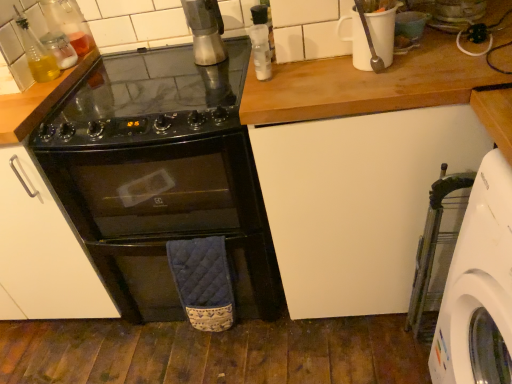
Question: Is white plastic washing machine at lower right shorter than translucent glass bottle at upper left, positioned as the second bottle in left-to-right order?

Choices:
 (A) no
 (B) yes

Answer: (A)

Question: Is white plastic washing machine at lower right turned away from translucent glass bottle at upper left, positioned as the 2th bottle in right-to-left order?

Choices:
 (A) yes
 (B) no

Answer: (B)

Question: From the image's perspective, would you say white plastic washing machine at lower right is positioned over translucent glass bottle at upper left, positioned as the 2th bottle in right-to-left order?

Choices:
 (A) no
 (B) yes

Answer: (A)

Question: Is white plastic washing machine at lower right closer to camera compared to translucent glass bottle at upper left, positioned as the 2th bottle in right-to-left order?

Choices:
 (A) yes
 (B) no

Answer: (A)

Question: Are white plastic washing machine at lower right and translucent glass bottle at upper left, positioned as the second bottle in left-to-right order, making contact?

Choices:
 (A) yes
 (B) no

Answer: (B)

Question: Is white plastic washing machine at lower right wider than translucent glass bottle at upper left, positioned as the second bottle in left-to-right order?

Choices:
 (A) no
 (B) yes

Answer: (B)

Question: Does metallic silver grinder at upper center have a smaller size compared to translucent glass bottle at upper left, positioned as the 2th bottle in right-to-left order?

Choices:
 (A) no
 (B) yes

Answer: (A)

Question: From a real-world perspective, does metallic silver grinder at upper center stand above translucent glass bottle at upper left, positioned as the 2th bottle in right-to-left order?

Choices:
 (A) no
 (B) yes

Answer: (B)

Question: Is translucent glass bottle at upper left, positioned as the second bottle in left-to-right order, a part of metallic silver grinder at upper center?

Choices:
 (A) no
 (B) yes

Answer: (A)

Question: Is metallic silver grinder at upper center bigger than translucent glass bottle at upper left, positioned as the 2th bottle in right-to-left order?

Choices:
 (A) yes
 (B) no

Answer: (A)

Question: Is there a large distance between metallic silver grinder at upper center and translucent glass bottle at upper left, positioned as the second bottle in left-to-right order?

Choices:
 (A) no
 (B) yes

Answer: (A)

Question: Is metallic silver grinder at upper center looking in the opposite direction of translucent glass bottle at upper left, positioned as the 2th bottle in right-to-left order?

Choices:
 (A) yes
 (B) no

Answer: (B)

Question: Could you tell me if translucent glass bottle at upper left, positioned as the 2th bottle in right-to-left order, is turned towards black glass gas stove at center?

Choices:
 (A) yes
 (B) no

Answer: (A)